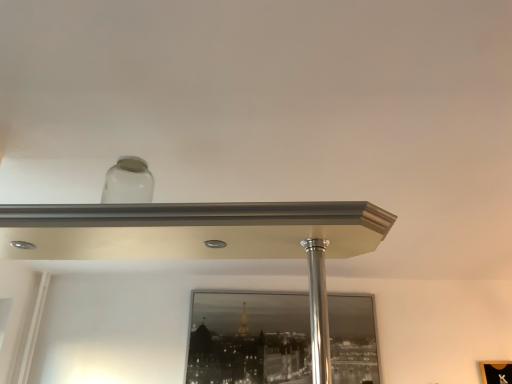
Question: Considering the relative sizes of black glass mirror at center and polished silver pole at center in the image provided, is black glass mirror at center smaller than polished silver pole at center?

Choices:
 (A) no
 (B) yes

Answer: (A)

Question: Is black glass mirror at center to the left of polished silver pole at center from the viewer's perspective?

Choices:
 (A) yes
 (B) no

Answer: (A)

Question: Is black glass mirror at center positioned behind polished silver pole at center?

Choices:
 (A) no
 (B) yes

Answer: (B)

Question: Is black glass mirror at center thinner than polished silver pole at center?

Choices:
 (A) yes
 (B) no

Answer: (B)

Question: Can polished silver pole at center be found inside black glass mirror at center?

Choices:
 (A) no
 (B) yes

Answer: (A)

Question: From a real-world perspective, is black glass mirror at center physically above polished silver pole at center?

Choices:
 (A) no
 (B) yes

Answer: (B)

Question: Can you confirm if polished silver pole at center is taller than black glass mirror at center?

Choices:
 (A) yes
 (B) no

Answer: (B)

Question: Considering the relative positions of polished silver pole at center and black glass mirror at center in the image provided, is polished silver pole at center to the left of black glass mirror at center from the viewer's perspective?

Choices:
 (A) no
 (B) yes

Answer: (A)

Question: Is black glass mirror at center a part of polished silver pole at center?

Choices:
 (A) no
 (B) yes

Answer: (A)

Question: Does polished silver pole at center touch black glass mirror at center?

Choices:
 (A) no
 (B) yes

Answer: (A)

Question: Is the depth of polished silver pole at center less than that of black glass mirror at center?

Choices:
 (A) no
 (B) yes

Answer: (B)

Question: Is polished silver pole at center looking in the opposite direction of black glass mirror at center?

Choices:
 (A) yes
 (B) no

Answer: (B)

Question: From the image's perspective, relative to polished silver pole at center, is black glass mirror at center above or below?

Choices:
 (A) above
 (B) below

Answer: (B)